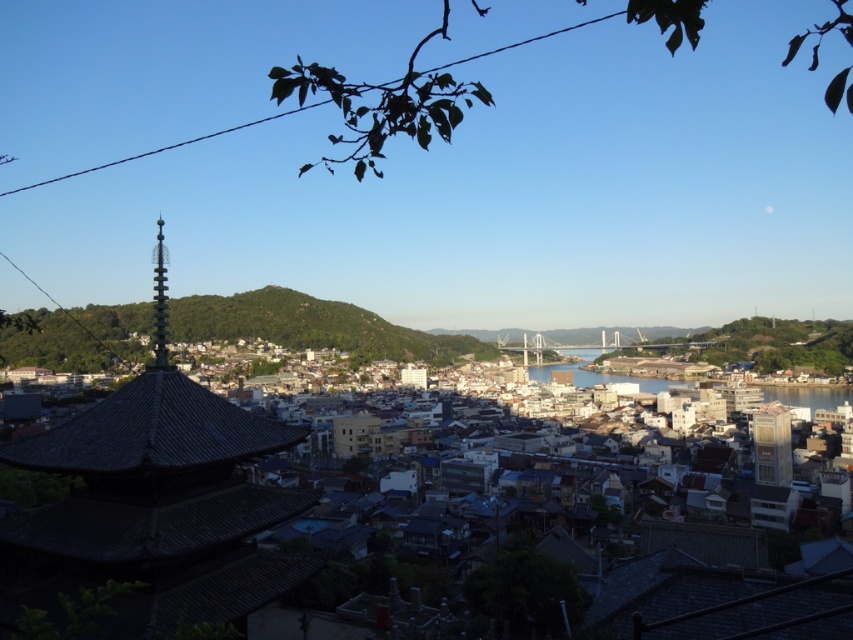
Does dark gray stone pagoda at lower left appear over green grassy hill at center?

Actually, dark gray stone pagoda at lower left is below green grassy hill at center.

You are a GUI agent. You are given a task and a screenshot of the screen. Output one action in this format:
    pyautogui.click(x=<x>, y=<y>)
    Task: Click on the dark gray stone pagoda at lower left
    
    Given the screenshot: What is the action you would take?
    pyautogui.click(x=151, y=513)

Who is more distant from viewer, (x=374, y=346) or (x=590, y=349)?

The point (x=590, y=349) is behind.

Can you confirm if green grassy hill at center is thinner than clear water at center?

No, green grassy hill at center is not thinner than clear water at center.

This screenshot has height=640, width=853. What are the coordinates of `green grassy hill at center` in the screenshot? It's located at (312, 326).

Which of these two, dark gray stone pagoda at lower left or clear water at center, stands shorter?

dark gray stone pagoda at lower left is shorter.

What do you see at coordinates (151, 513) in the screenshot?
I see `dark gray stone pagoda at lower left` at bounding box center [151, 513].

Find the location of a particular element. The height and width of the screenshot is (640, 853). dark gray stone pagoda at lower left is located at coordinates (151, 513).